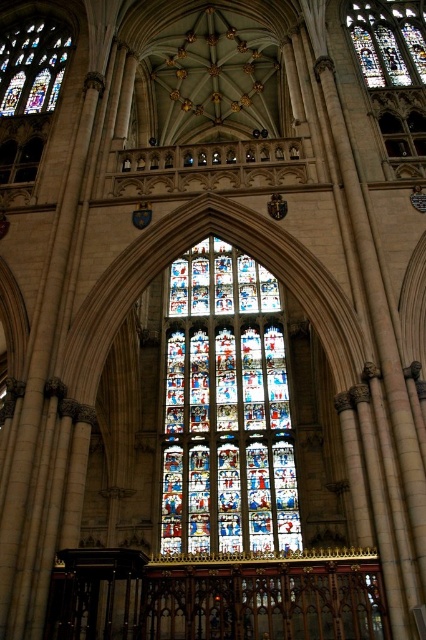
Based on the photo, you are standing inside the cathedral and looking at the ceiling. You notice two points marked as point 1 and point 2. Point 1 is at coordinate (391, 65) and point 2 is at (377, 49). Which point is closer to your eyes?

Point 1 is closer to your eyes because it is positioned closer to the camera than point 2.

Looking at this image, you are standing at the entrance of the cathedral and want to take a photo of the stained glass window at center. Considering the distance, will you need a telephoto lens to capture the entire window in one frame?

The stained glass window at center is 217.23 feet away from the viewer. A telephoto lens is necessary to capture the entire window in one frame from that distance.